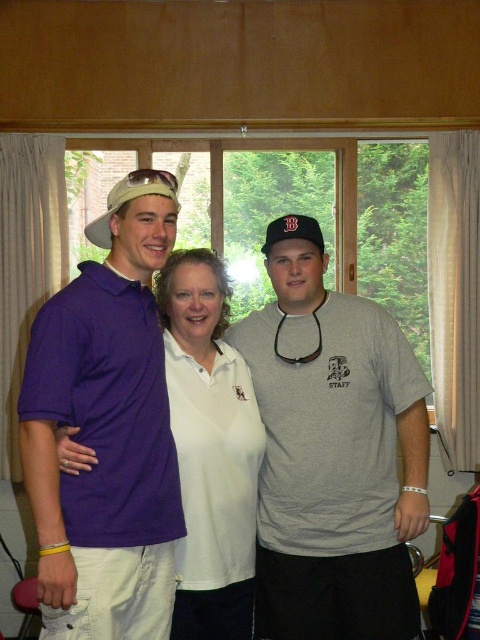
Question: Is white smooth shirt at center further to the viewer compared to beige fabric baseball cap at center?

Choices:
 (A) yes
 (B) no

Answer: (A)

Question: Does beige fabric baseball cap at center have a lesser width compared to black fabric baseball cap at center?

Choices:
 (A) no
 (B) yes

Answer: (A)

Question: Which object appears closest to the camera in this image?

Choices:
 (A) purple matte polo shirt at left
 (B) white smooth shirt at center
 (C) beige fabric baseball cap at center

Answer: (A)

Question: Estimate the real-world distances between objects in this image. Which object is farther from the white smooth shirt at center?

Choices:
 (A) purple matte polo shirt at left
 (B) gray matte t-shirt at center
 (C) black fabric baseball cap at center

Answer: (C)

Question: Is the position of white smooth shirt at center more distant than that of black fabric baseball cap at center?

Choices:
 (A) yes
 (B) no

Answer: (B)

Question: Which is nearer to the gray matte t-shirt at center?

Choices:
 (A) white smooth shirt at center
 (B) beige fabric baseball cap at center
 (C) black fabric baseball cap at center
 (D) purple matte polo shirt at left

Answer: (A)